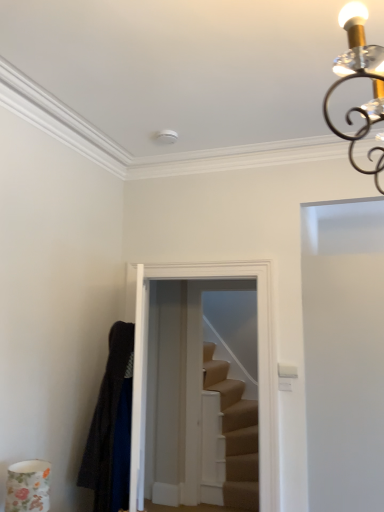
Question: Is white matte door at right far from beige carpeted stairs at center?

Choices:
 (A) yes
 (B) no

Answer: (A)

Question: Does white matte door at right touch beige carpeted stairs at center?

Choices:
 (A) yes
 (B) no

Answer: (B)

Question: Is white matte door at right thinner than beige carpeted stairs at center?

Choices:
 (A) yes
 (B) no

Answer: (B)

Question: From a real-world perspective, is white matte door at right located beneath beige carpeted stairs at center?

Choices:
 (A) yes
 (B) no

Answer: (B)

Question: From the image's perspective, does white matte door at right appear higher than beige carpeted stairs at center?

Choices:
 (A) yes
 (B) no

Answer: (A)

Question: Considering the relative sizes of white matte door at right and beige carpeted stairs at center in the image provided, is white matte door at right taller than beige carpeted stairs at center?

Choices:
 (A) no
 (B) yes

Answer: (B)

Question: Would you consider clear glass door at center to be distant from beige carpeted stairs at center?

Choices:
 (A) no
 (B) yes

Answer: (B)

Question: Considering the relative positions of clear glass door at center and beige carpeted stairs at center in the image provided, is clear glass door at center to the right of beige carpeted stairs at center from the viewer's perspective?

Choices:
 (A) no
 (B) yes

Answer: (A)

Question: Can you confirm if clear glass door at center is taller than beige carpeted stairs at center?

Choices:
 (A) yes
 (B) no

Answer: (B)

Question: From a real-world perspective, is clear glass door at center over beige carpeted stairs at center?

Choices:
 (A) yes
 (B) no

Answer: (A)

Question: Is clear glass door at center aimed at beige carpeted stairs at center?

Choices:
 (A) yes
 (B) no

Answer: (A)

Question: Considering the relative sizes of clear glass door at center and beige carpeted stairs at center in the image provided, is clear glass door at center thinner than beige carpeted stairs at center?

Choices:
 (A) no
 (B) yes

Answer: (A)

Question: Does dark woolen robe at left have a greater width compared to white matte door at right?

Choices:
 (A) yes
 (B) no

Answer: (B)